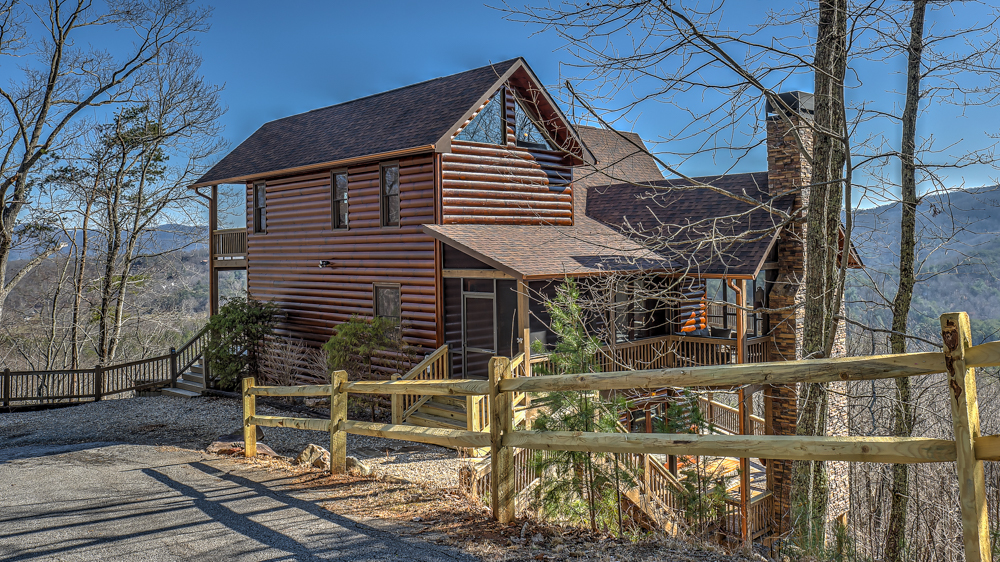
Where is `chimney`? The image size is (1000, 562). chimney is located at coordinates (783, 165).